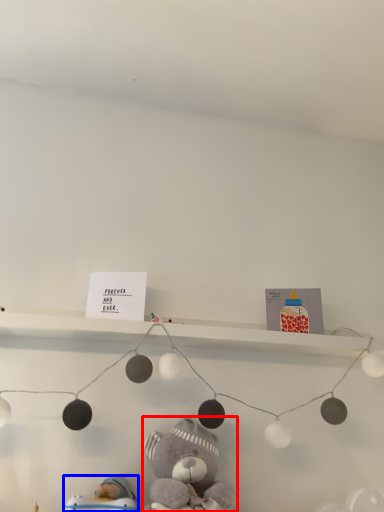
Question: Which of the following is the closest to the observer, teddy bear (highlighted by a red box) or toy (highlighted by a blue box)?

Choices:
 (A) teddy bear
 (B) toy

Answer: (A)